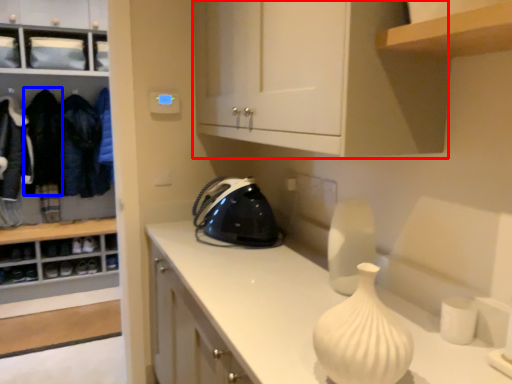
Question: Among these objects, which one is nearest to the camera, cabinetry (highlighted by a red box) or clothing (highlighted by a blue box)?

Choices:
 (A) cabinetry
 (B) clothing

Answer: (A)